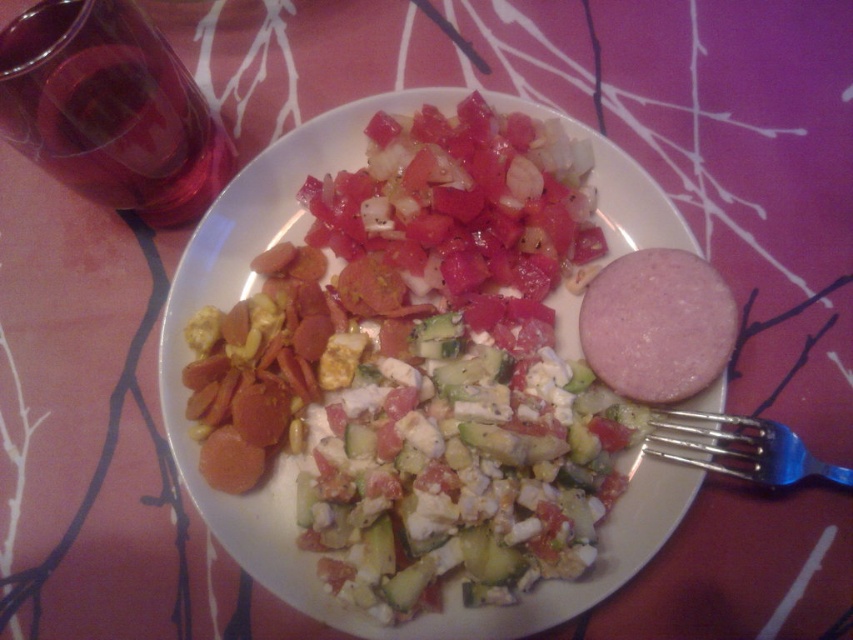
Question: Which of the following is the closest to the observer?

Choices:
 (A) pink smooth ham at center
 (B) blue metallic fork at lower right

Answer: (B)

Question: Where is white ceramic plate at center located in relation to pink smooth ham at center in the image?

Choices:
 (A) right
 (B) left

Answer: (B)

Question: Which point appears farthest from the camera in this image?

Choices:
 (A) (196, 186)
 (B) (740, 476)
 (C) (605, 378)

Answer: (A)

Question: Does pink smooth ham at center have a lesser width compared to blue metallic fork at lower right?

Choices:
 (A) yes
 (B) no

Answer: (A)

Question: Does white ceramic plate at center appear on the right side of pink smooth ham at center?

Choices:
 (A) yes
 (B) no

Answer: (B)

Question: Which point is closer to the camera taking this photo?

Choices:
 (A) [682, 264]
 (B) [76, 138]
 (C) [819, 468]

Answer: (B)